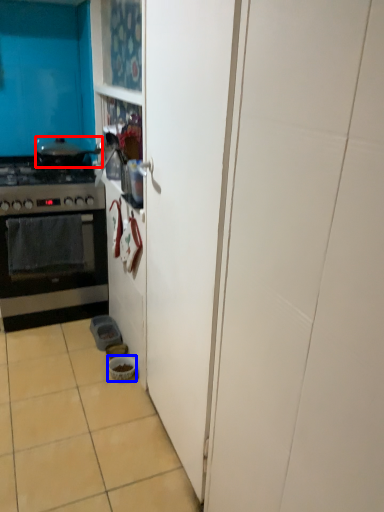
Question: Which point is closer to the camera, pot/pan (highlighted by a red box) or bowl (highlighted by a blue box)?

Choices:
 (A) pot/pan
 (B) bowl

Answer: (B)